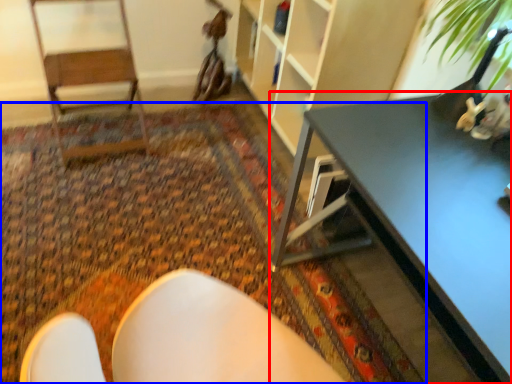
Question: Which object is closer to the camera taking this photo, table (highlighted by a red box) or mat (highlighted by a blue box)?

Choices:
 (A) table
 (B) mat

Answer: (A)